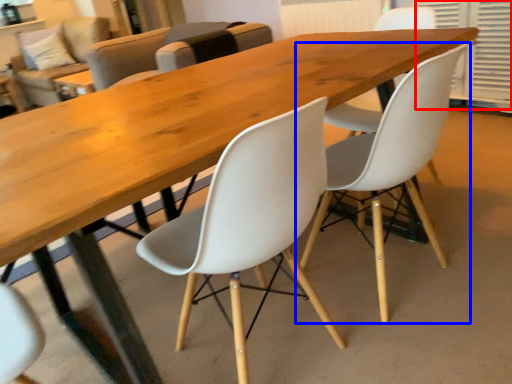
Question: Which object appears closest to the camera in this image, shutter (highlighted by a red box) or chair (highlighted by a blue box)?

Choices:
 (A) shutter
 (B) chair

Answer: (B)